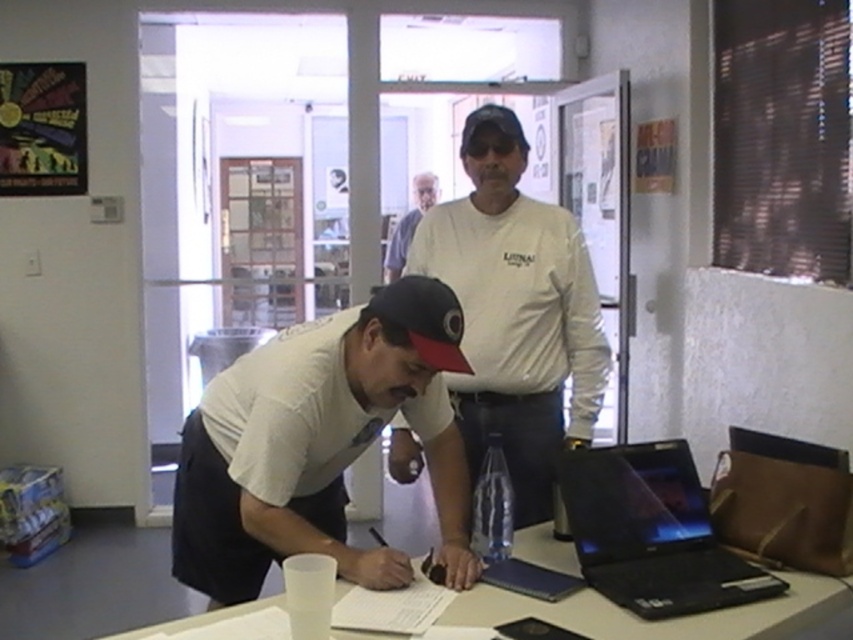
Which is more to the right, white matte shirt at center or white matte table at center?

white matte table at center is more to the right.

Is white matte shirt at center above white matte table at center?

Yes, white matte shirt at center is above white matte table at center.

Describe the element at coordinates (318, 444) in the screenshot. The height and width of the screenshot is (640, 853). I see `white matte shirt at center` at that location.

Where is `white matte shirt at center`? white matte shirt at center is located at coordinates (318, 444).

Is white matte shirt at center wider than black matte laptop at lower right?

Yes.

Is point (234, 468) less distant than point (598, 582)?

Yes, it is.

The height and width of the screenshot is (640, 853). What do you see at coordinates (318, 444) in the screenshot? I see `white matte shirt at center` at bounding box center [318, 444].

Identify the location of white matte shirt at center. Image resolution: width=853 pixels, height=640 pixels. pos(318,444).

Is point (247, 397) positioned behind point (392, 308)?

That is True.

The height and width of the screenshot is (640, 853). I want to click on white matte shirt at center, so click(318, 444).

This screenshot has width=853, height=640. What do you see at coordinates (318, 444) in the screenshot?
I see `white matte shirt at center` at bounding box center [318, 444].

Locate an element on the screen. The height and width of the screenshot is (640, 853). white matte shirt at center is located at coordinates (318, 444).